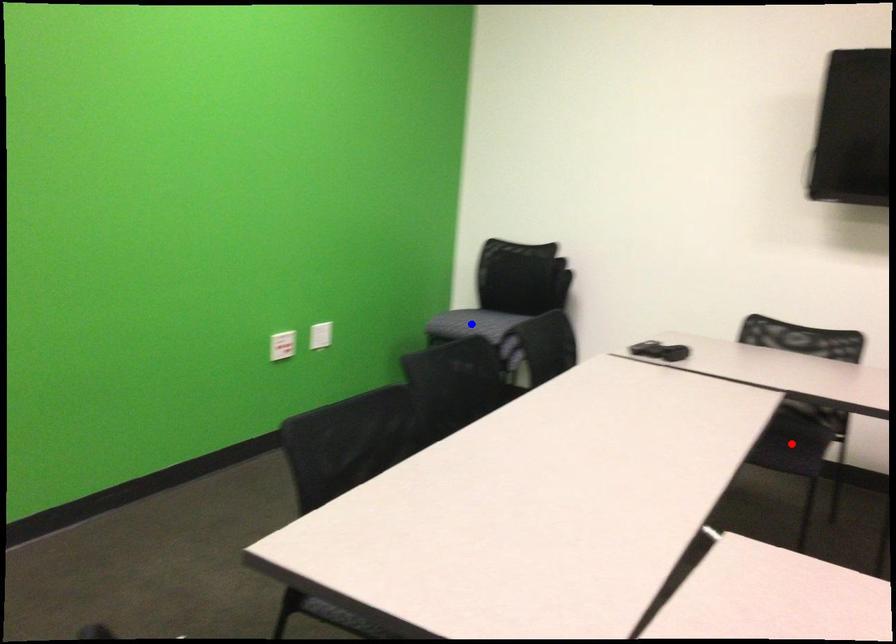
Question: Which of the two points in the image is closer to the camera?

Choices:
 (A) Blue point is closer.
 (B) Red point is closer.

Answer: (B)